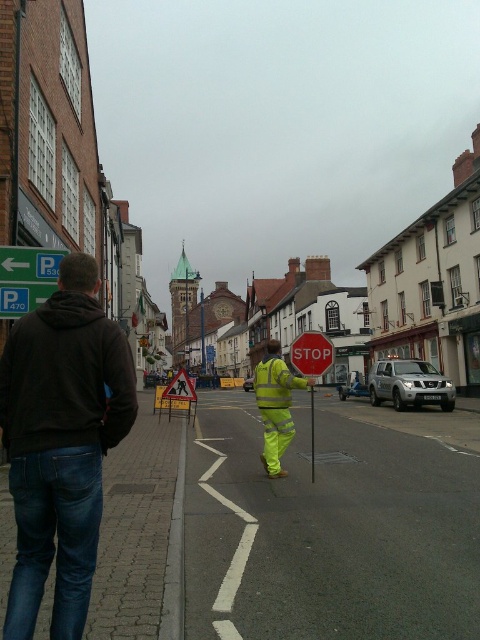
Question: Does dark brown hoodie at left have a smaller size compared to high visibility yellow-green safety vest at center?

Choices:
 (A) yes
 (B) no

Answer: (A)

Question: Which object appears closest to the camera in this image?

Choices:
 (A) green plastic sign at upper left
 (B) green plastic parking sign at upper left
 (C) high-visibility yellow jacket at center

Answer: (C)

Question: Which point appears closest to the camera in this image?

Choices:
 (A) (275, 374)
 (B) (17, 291)
 (C) (58, 490)
 (D) (8, 250)

Answer: (C)

Question: Is green plastic sign at upper left to the left of green plastic parking sign at upper left from the viewer's perspective?

Choices:
 (A) yes
 (B) no

Answer: (B)

Question: Which object is closer to the camera taking this photo?

Choices:
 (A) metallic reflective stop sign at center
 (B) dark brown hoodie at left

Answer: (B)

Question: In this image, where is metallic reflective stop sign at center located relative to green plastic parking sign at upper left?

Choices:
 (A) below
 (B) above

Answer: (A)